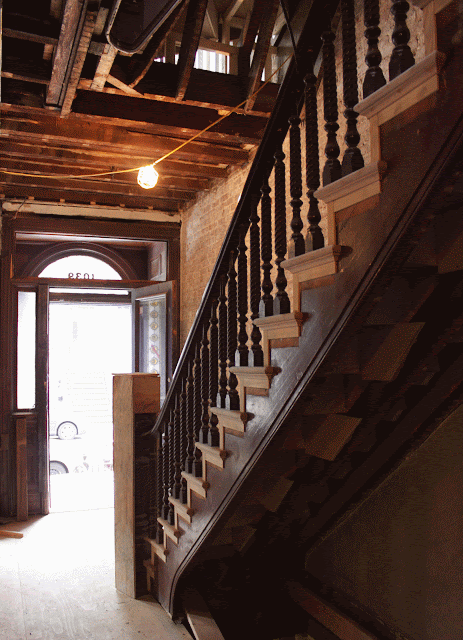
At what (x,y) coordinates should I click in order to perform the action: click on floor. Please return your answer as a coordinate pair (x, y). Looking at the image, I should click on (54, 582).